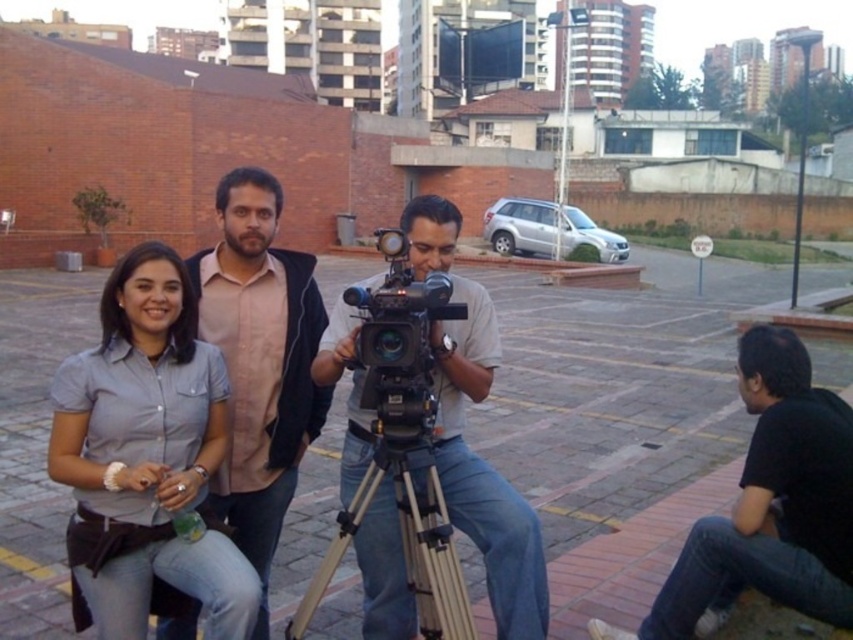
Who is higher up, matte pink shirt at center or black plastic video camera at center?

black plastic video camera at center is above.

Can you confirm if matte pink shirt at center is taller than black plastic video camera at center?

Correct, matte pink shirt at center is much taller as black plastic video camera at center.

Describe the element at coordinates (260, 362) in the screenshot. I see `matte pink shirt at center` at that location.

Locate an element on the screen. The image size is (853, 640). matte pink shirt at center is located at coordinates (260, 362).

Which of these two, gray matte shirt at center or matte black camera at center, stands shorter?

matte black camera at center is shorter.

Is point (86, 352) farther from camera compared to point (413, 221)?

No.

I want to click on gray matte shirt at center, so click(x=146, y=458).

Is point (108, 355) positioned before point (206, 250)?

Yes, it is.

Is gray matte shirt at center positioned at the back of matte pink shirt at center?

No, it is in front of matte pink shirt at center.

Between point (141, 272) and point (308, 260), which one is positioned behind?

Positioned behind is point (308, 260).

Find the location of a particular element. The height and width of the screenshot is (640, 853). gray matte shirt at center is located at coordinates (146, 458).